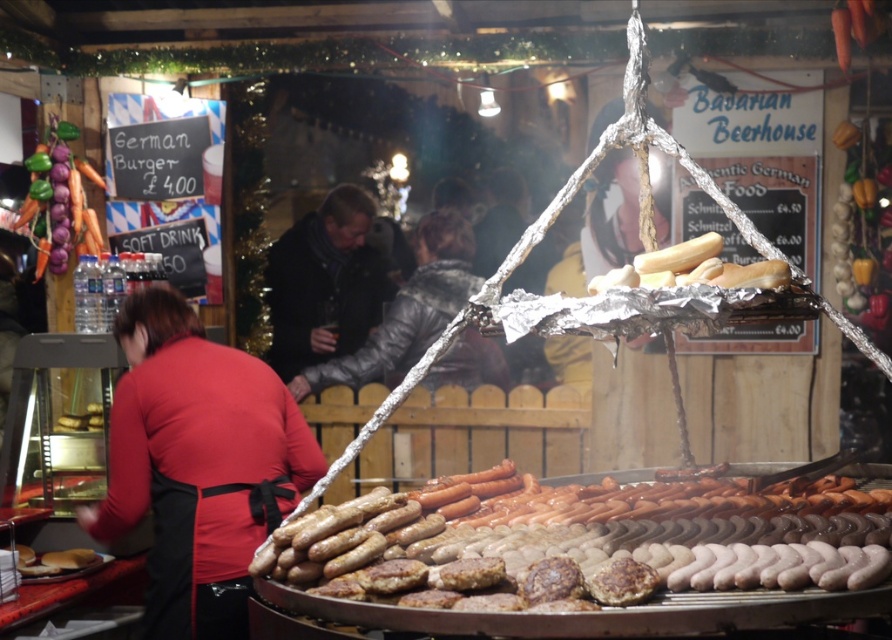
You are a customer at the German Christmas market and want to know if the red fabric apron at left can be used to wrap the golden brown sausages at center. Based on their sizes, is this possible?

The red fabric apron at left is thinner than the golden brown sausages at center, so it might not be wide enough to properly wrap around them. Consider using a larger or wider piece of fabric instead.

You are a customer at the German Christmas market stall. You want to grab a sausage from the golden brown sausages at center while avoiding the gray woolen jacket at center. In which direction should you move relative to the jacket?

The golden brown sausages at center are to the right of the gray woolen jacket at center. To grab the sausages while avoiding the jacket, you should move to the right side of the jacket.

You are a customer at the German Christmas market stall. You see the red fabric apron at left and the golden brown sausages at center. Which item is positioned more to the left side of the scene?

The red fabric apron at left is positioned more to the left side of the scene than the golden brown sausages at center.